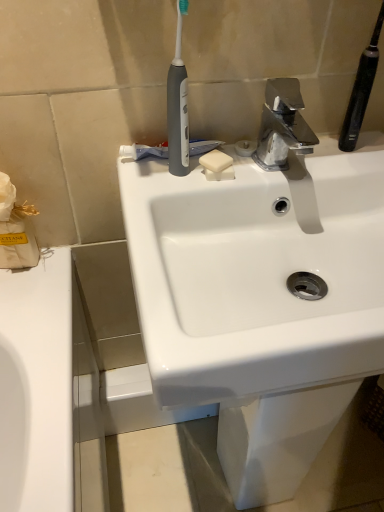
The width and height of the screenshot is (384, 512). In order to click on vacant space in between black rubberized toothbrush at upper right, arranged as the 1th toothbrush when viewed from the right, and polished chrome faucet at upper center in this screenshot , I will do `click(328, 159)`.